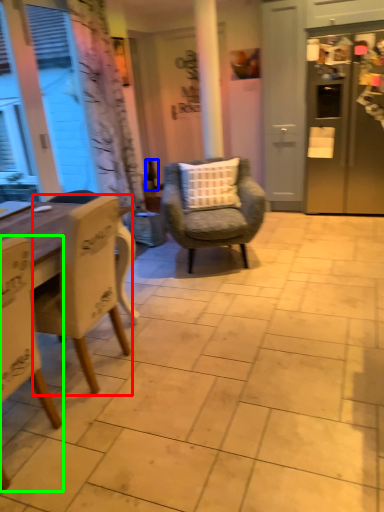
Question: Which is nearer to the chair (highlighted by a red box)? bottle (highlighted by a blue box) or chair (highlighted by a green box).

Choices:
 (A) bottle
 (B) chair

Answer: (B)